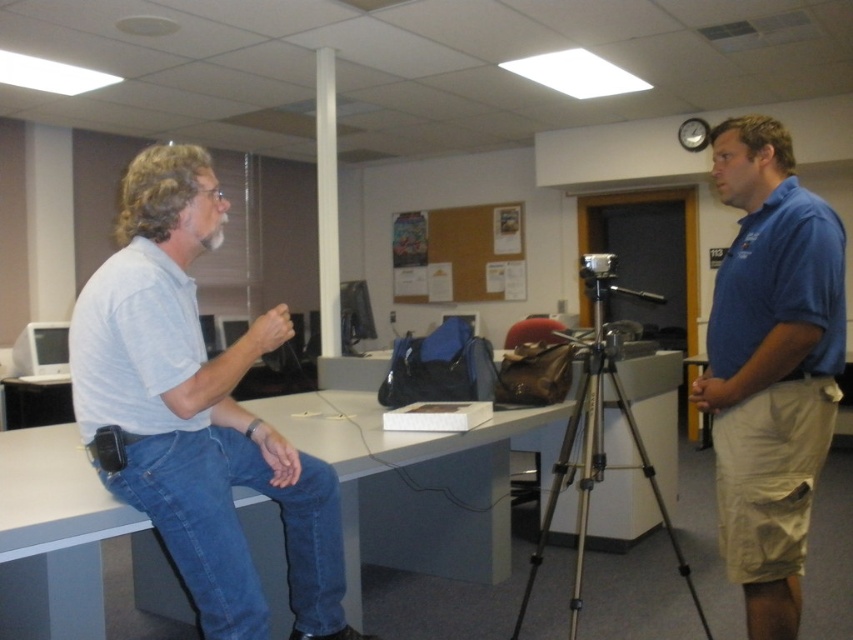
Looking at this image, which of these two, blue cotton shirt at right or denim at left, stands taller?

blue cotton shirt at right is taller.

Does point (782, 129) come behind point (281, 497)?

Yes, point (782, 129) is behind point (281, 497).

You are a GUI agent. You are given a task and a screenshot of the screen. Output one action in this format:
    pyautogui.click(x=<x>, y=<y>)
    Task: Click on the blue cotton shirt at right
    The height and width of the screenshot is (640, 853).
    Given the screenshot: What is the action you would take?
    pyautogui.click(x=770, y=365)

The height and width of the screenshot is (640, 853). What are the coordinates of `blue cotton shirt at right` in the screenshot? It's located at (770, 365).

Identify the location of light gray cotton shirt at left. The height and width of the screenshot is (640, 853). (196, 412).

Measure the distance from light gray cotton shirt at left to denim at left.

light gray cotton shirt at left and denim at left are 2.63 inches apart from each other.

Does point (161, 310) lie behind point (178, 566)?

That is False.

Locate an element on the screen. The height and width of the screenshot is (640, 853). light gray cotton shirt at left is located at coordinates (196, 412).

Looking at this image, who is taller, white glossy table at center or silver metallic tripod at center?

silver metallic tripod at center

Does white glossy table at center appear on the left side of silver metallic tripod at center?

Indeed, white glossy table at center is positioned on the left side of silver metallic tripod at center.

You are a GUI agent. You are given a task and a screenshot of the screen. Output one action in this format:
    pyautogui.click(x=<x>, y=<y>)
    Task: Click on the white glossy table at center
    The image size is (853, 640).
    Given the screenshot: What is the action you would take?
    pyautogui.click(x=418, y=483)